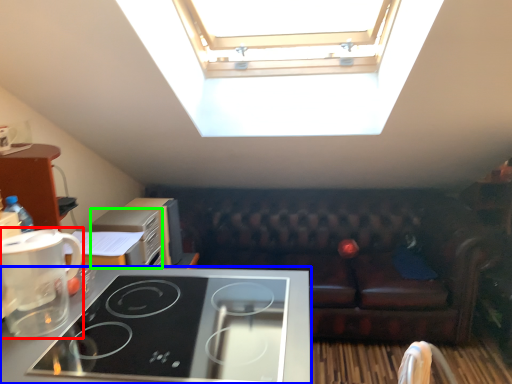
Question: Which is nearer to the coffee maker (highlighted by a red box)? home appliance (highlighted by a blue box) or appliance (highlighted by a green box).

Choices:
 (A) home appliance
 (B) appliance

Answer: (A)